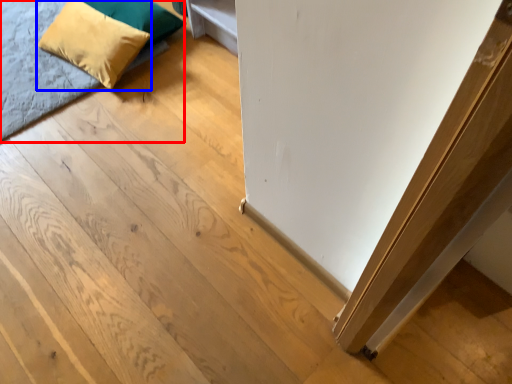
Question: Which of the following is the farthest to the observer, bed (highlighted by a red box) or pillow (highlighted by a blue box)?

Choices:
 (A) bed
 (B) pillow

Answer: (B)